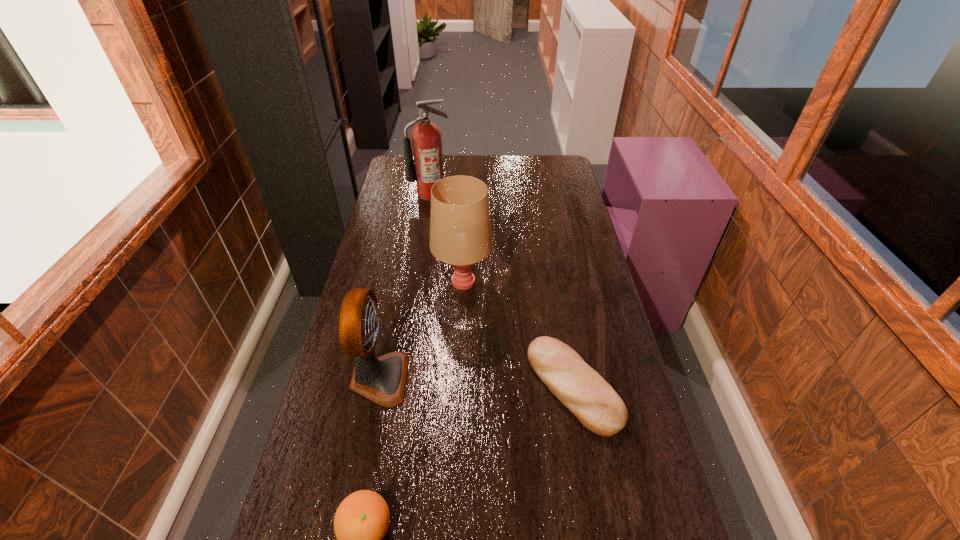
Locate an element on the screen. fan present at the left edge is located at coordinates pyautogui.click(x=382, y=380).

This screenshot has height=540, width=960. Identify the location of object that is at the right edge. (598, 407).

This screenshot has width=960, height=540. In order to click on vacant region at the left edge of the desktop in this screenshot , I will do `click(374, 263)`.

In the image, there is a desktop. Where is `vacant space at the right edge`? vacant space at the right edge is located at coordinates (565, 181).

Find the location of a particular element. Image resolution: width=960 pixels, height=540 pixels. free space at the far right corner of the desktop is located at coordinates (550, 163).

The image size is (960, 540). I want to click on free space between the fan and the lampshade, so click(x=421, y=330).

Image resolution: width=960 pixels, height=540 pixels. Identify the location of vacant space that's between the fan and the shortest object. pos(477,382).

Select which object appears as the second closest to the lampshade. Please provide its 2D coordinates. Your answer should be formatted as a tuple, i.e. [(x, y)], where the tuple contains the x and y coordinates of a point satisfying the conditions above.

[(382, 380)]

Locate which object is the third closest to the lampshade. Please provide its 2D coordinates. Your answer should be formatted as a tuple, i.e. [(x, y)], where the tuple contains the x and y coordinates of a point satisfying the conditions above.

[(426, 169)]

Find the location of a particular element. Image resolution: width=960 pixels, height=540 pixels. free space that satisfies the following two spatial constraints: 1. on the front of the rightmost object near the operation label; 2. on the left side of the fire extinguisher is located at coordinates (402, 386).